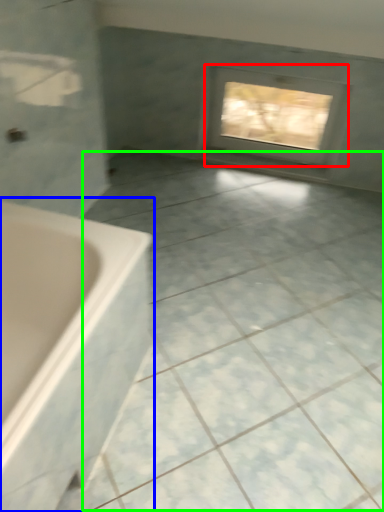
Question: Which object is the closest to the window (highlighted by a red box)? Choose among these: bathtub (highlighted by a blue box) or ceramic tile (highlighted by a green box).

Choices:
 (A) bathtub
 (B) ceramic tile

Answer: (B)